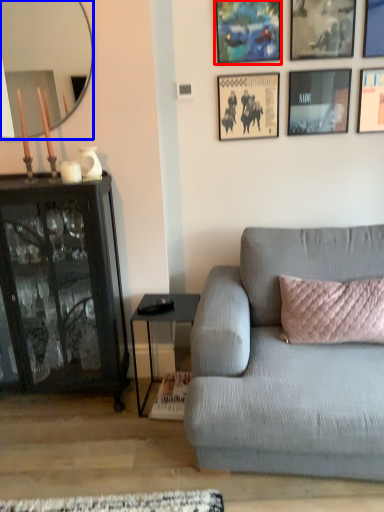
Question: Among these objects, which one is farthest to the camera, picture frame (highlighted by a red box) or mirror (highlighted by a blue box)?

Choices:
 (A) picture frame
 (B) mirror

Answer: (A)